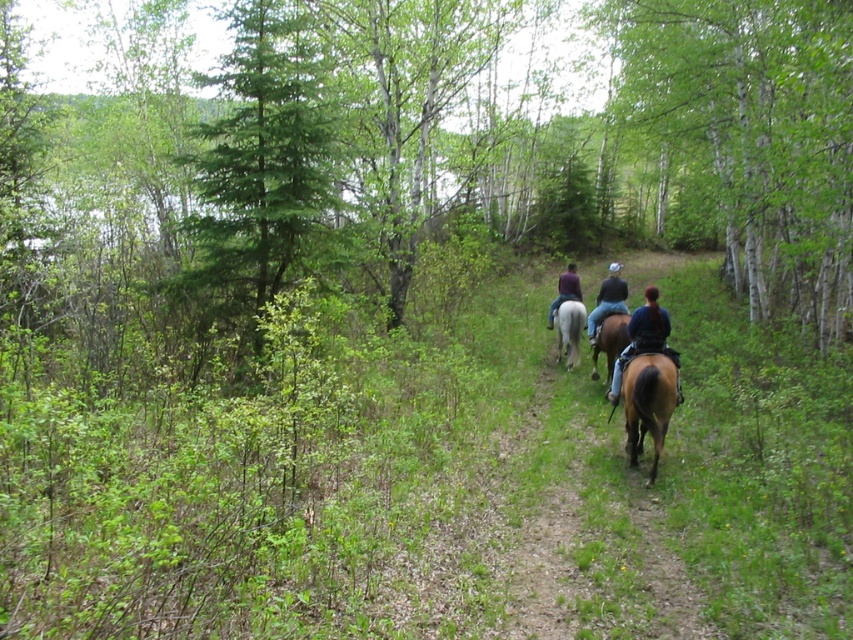
Does green leafy tree at right have a greater height compared to green matte tree at upper left?

Yes.

Who is more distant from viewer, (721, 45) or (219, 182)?

The point (721, 45) is more distant.

Image resolution: width=853 pixels, height=640 pixels. Identify the location of green leafy tree at right. (751, 138).

Can you confirm if brown glossy horse at lower center is positioned to the right of dark blue denim jacket at center?

Incorrect, brown glossy horse at lower center is not on the right side of dark blue denim jacket at center.

Who is positioned more to the left, brown glossy horse at lower center or dark blue denim jacket at center?

brown glossy horse at lower center

Find the location of a particular element. Image resolution: width=853 pixels, height=640 pixels. brown glossy horse at lower center is located at coordinates (648, 403).

Does point (637, 413) come in front of point (637, 317)?

Yes, it is in front of point (637, 317).

Who is more distant from viewer, (633,365) or (635,346)?

Point (635,346)

Is point (622, 387) farther from viewer compared to point (654, 307)?

Yes.

Locate an element on the screen. The width and height of the screenshot is (853, 640). brown glossy horse at lower center is located at coordinates (648, 403).